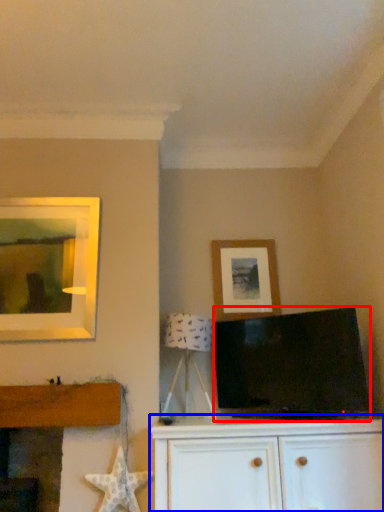
Question: Which object appears farthest to the camera in this image, television (highlighted by a red box) or cabinetry (highlighted by a blue box)?

Choices:
 (A) television
 (B) cabinetry

Answer: (A)